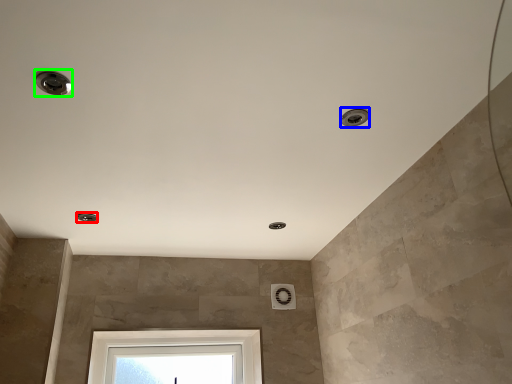
Question: Which object is positioned closest to droplight (highlighted by a red box)? Select from droplight (highlighted by a blue box) and droplight (highlighted by a green box).

Choices:
 (A) droplight
 (B) droplight

Answer: (B)